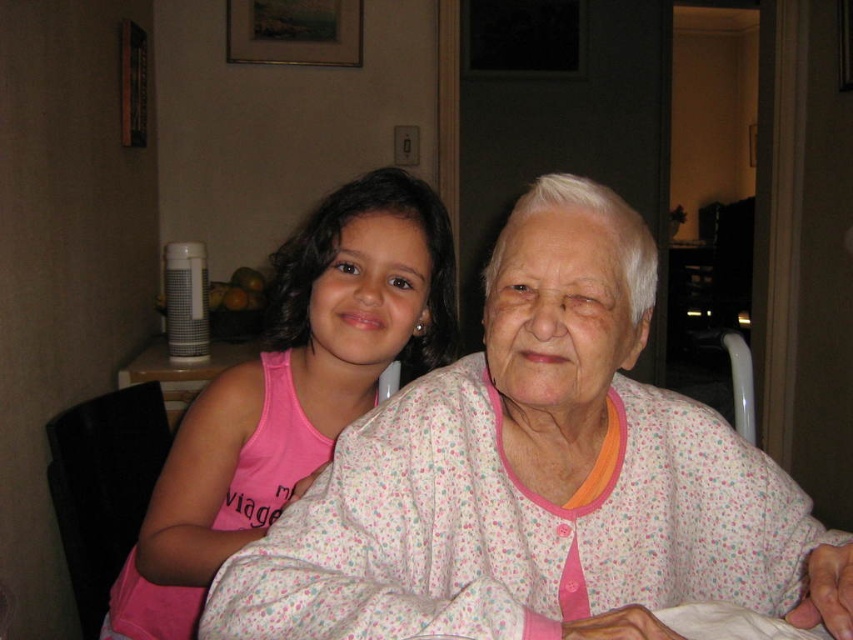
You are taking a photo of two people sitting on a couch. There are two points marked on the image at coordinates point (x=486, y=416) and point (x=271, y=513). Which point is closer to the camera?

Point (x=486, y=416) is closer to the camera than point (x=271, y=513).

You are a photographer trying to capture a closeup of the floral cotton pajamas at center and the pink fabric at center. Which one is covering the other?

The floral cotton pajamas at center is positioned over pink fabric at center, so the floral cotton pajamas at center is covering the pink fabric at center.